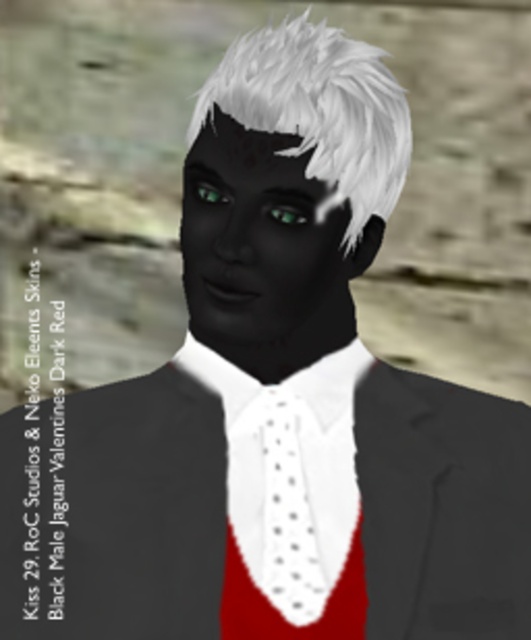
You are an artist trying to draw the character from the image. You want to ensure the green glossy eye at center is visible. Should you draw the white dotted fabric at center in front of or behind the eye?

The green glossy eye at center is behind the white dotted fabric at center, so to make the eye visible, you should draw the white dotted fabric at center in front of the eye.

You are designing a digital avatar and want to ensure proper proportions. Given the scene description, which object from the list has a larger height measurement between the white dotted fabric at center and the green glossy eye at center?

The white dotted fabric at center has a greater height compared to the green glossy eye at center according to the description.

You are designing a poster for a fashion show and need to highlight both the white dotted fabric at center and the green glossy eye at center. Which object should you make larger to emphasize its importance?

The white dotted fabric at center is larger in size than the green glossy eye at center, so to emphasize its importance, you should make the white dotted fabric at center larger.